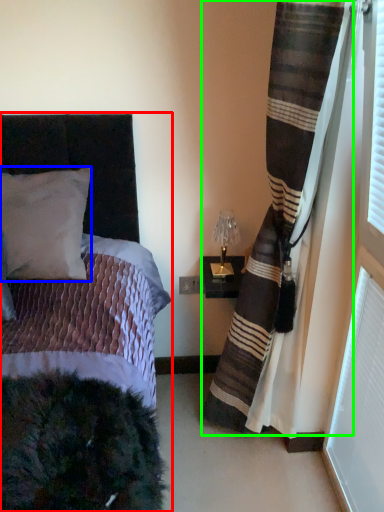
Question: Estimate the real-world distances between objects in this image. Which object is closer to bed (highlighted by a red box), pillow (highlighted by a blue box) or curtain (highlighted by a green box)?

Choices:
 (A) pillow
 (B) curtain

Answer: (A)